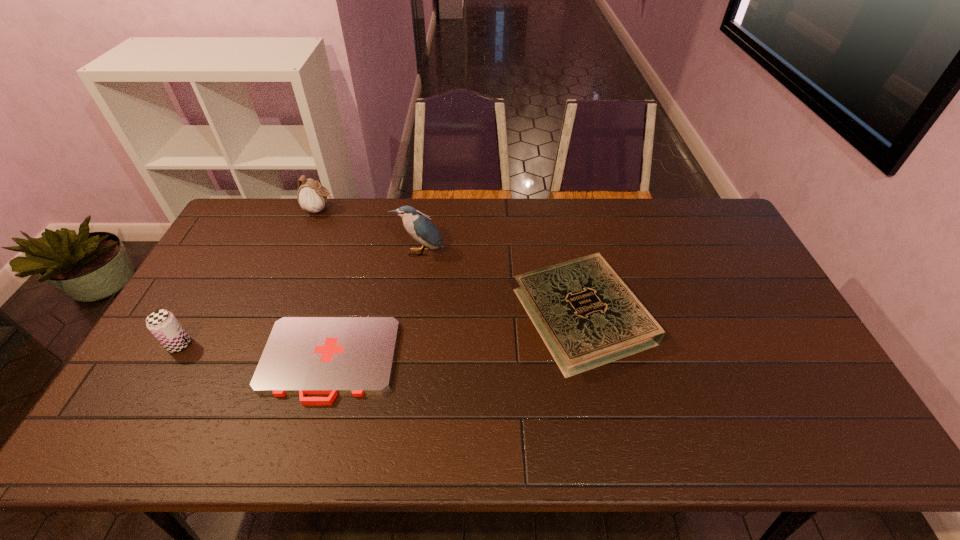
Locate an element on the screen. Image resolution: width=960 pixels, height=540 pixels. the tallest object is located at coordinates (420, 227).

Find the location of `bird`. bird is located at coordinates (420, 227).

The height and width of the screenshot is (540, 960). Find the location of `pouch`. pouch is located at coordinates (311, 196).

Where is `the leftmost object`? The height and width of the screenshot is (540, 960). the leftmost object is located at coordinates (164, 326).

Find the location of a particular element. the rightmost object is located at coordinates (586, 315).

What are the coordinates of `hardback book` in the screenshot? It's located at (586, 315).

Locate an element on the screen. The height and width of the screenshot is (540, 960). the first-aid kit is located at coordinates (303, 355).

The width and height of the screenshot is (960, 540). Find the location of `free space located 0.090m at the tip of the bird's beak`. free space located 0.090m at the tip of the bird's beak is located at coordinates (416, 279).

Locate an element on the screen. free space located on the front-facing side of the farthest object is located at coordinates (404, 210).

Identify the location of free region located on the right of the beer can. click(x=311, y=345).